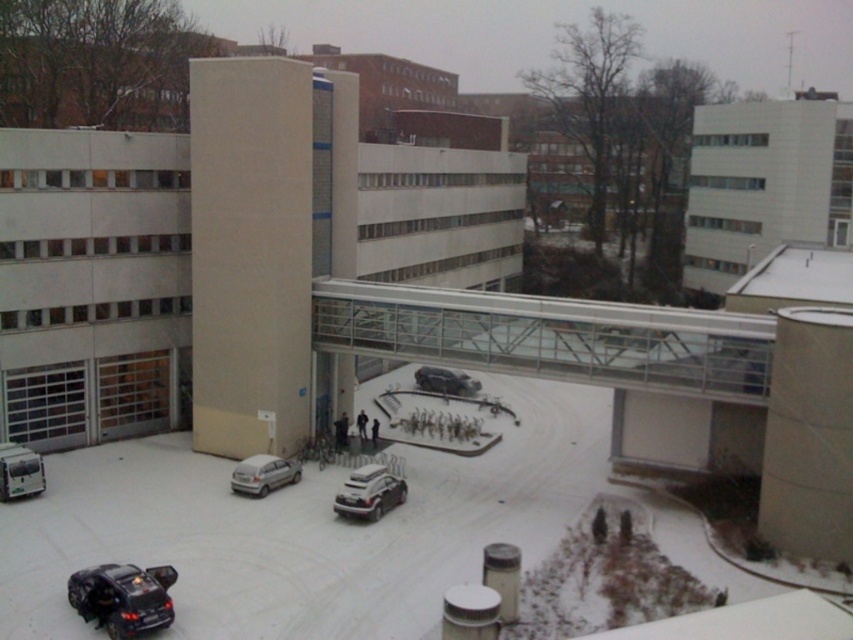
Does shiny black suv at lower left appear under shiny silver sedan at center?

Indeed, shiny black suv at lower left is positioned under shiny silver sedan at center.

Is shiny black suv at lower left shorter than shiny silver sedan at center?

In fact, shiny black suv at lower left may be taller than shiny silver sedan at center.

The image size is (853, 640). What are the coordinates of `shiny black suv at lower left` in the screenshot? It's located at (123, 596).

Is shiny black suv at lower left wider than satin silver car at center?

Yes.

Which is more to the left, shiny black suv at lower left or satin silver car at center?

shiny black suv at lower left

This screenshot has height=640, width=853. Find the location of `shiny black suv at lower left`. shiny black suv at lower left is located at coordinates (123, 596).

At what (x,y) coordinates should I click in order to perform the action: click on shiny black suv at lower left. Please return your answer as a coordinate pair (x, y). Looking at the image, I should click on (123, 596).

Is point (596, 346) farther from camera compared to point (244, 488)?

Yes, it is.

Does point (599, 348) lie in front of point (247, 464)?

No, (599, 348) is further to viewer.

The width and height of the screenshot is (853, 640). In order to click on transparent glass bridge at center in this screenshot , I will do `click(550, 337)`.